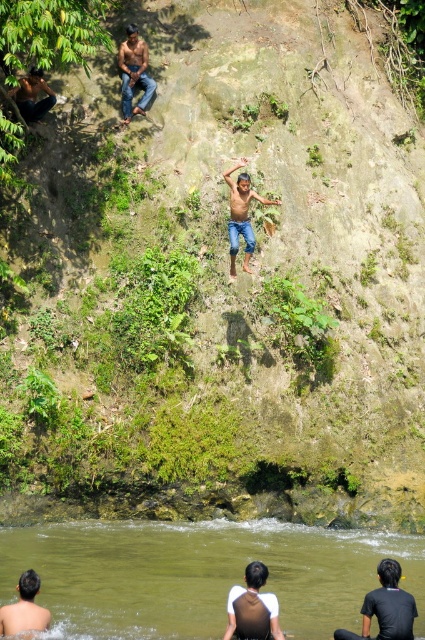
Does point (248, 243) come closer to viewer compared to point (127, 61)?

That is True.

Who is more distant from viewer, [232,253] or [141,42]?

Positioned behind is point [141,42].

The image size is (425, 640). I want to click on brown skin child at center, so click(241, 216).

The image size is (425, 640). I want to click on dark brown hair at lower right, so click(x=385, y=608).

Between dark brown hair at lower right and brown skin man at lower left, which one is positioned higher?

brown skin man at lower left is higher up.

Is point (396, 634) closer to camera compared to point (39, 620)?

No, (396, 634) is behind (39, 620).

The width and height of the screenshot is (425, 640). What are the coordinates of `dark brown hair at lower right` in the screenshot? It's located at (385, 608).

Which of these two, brown skin child at center or brown skin man at lower left, stands shorter?

Standing shorter between the two is brown skin man at lower left.

Does brown skin child at center appear over brown skin man at lower left?

Indeed, brown skin child at center is positioned over brown skin man at lower left.

In order to click on brown skin child at center in this screenshot , I will do `click(241, 216)`.